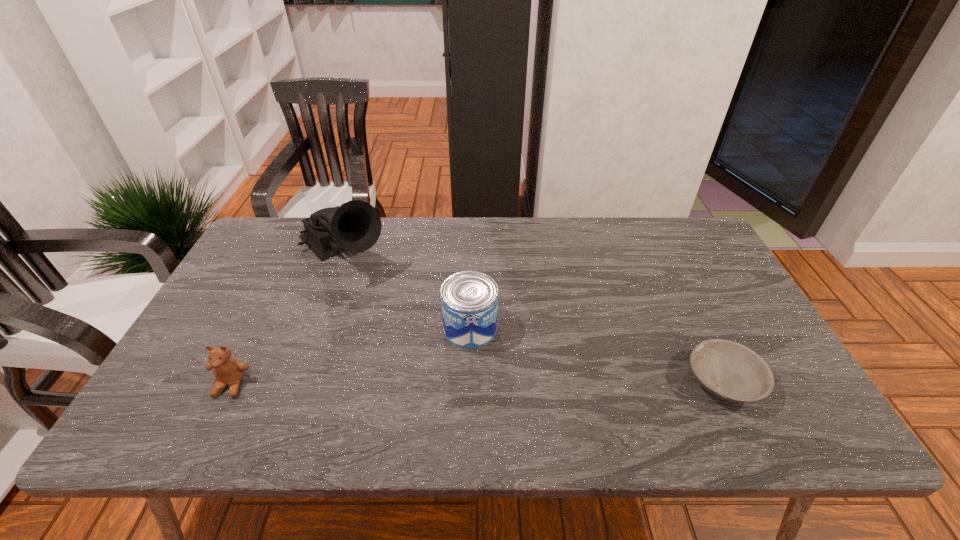
Locate an element on the screen. The width and height of the screenshot is (960, 540). free space on the desktop that is between the teddy bear and the rightmost object and is positioned from the horn of the tallest object is located at coordinates (474, 383).

In order to click on vacant space on the desktop that is between the teddy bear and the bowl and is positioned on the front label of the third object from left to right in this screenshot , I will do `click(543, 383)`.